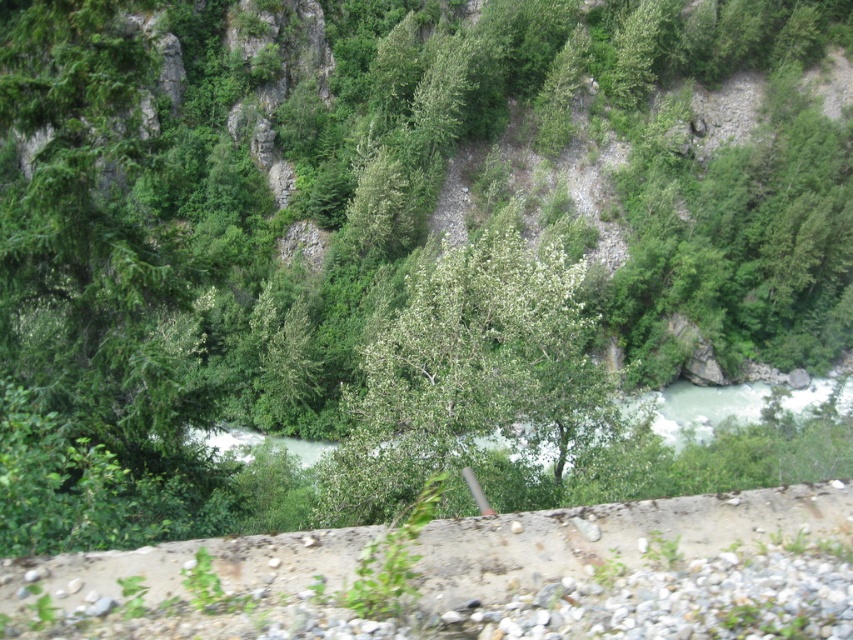
Between green matte tree at left and green leafy tree at center, which one has more height?

Standing taller between the two is green matte tree at left.

Who is lower down, green matte tree at left or green leafy tree at center?

green leafy tree at center

At what (x,y) coordinates should I click in order to perform the action: click on green matte tree at left. Please return your answer as a coordinate pair (x, y). Image resolution: width=853 pixels, height=640 pixels. Looking at the image, I should click on (90, 232).